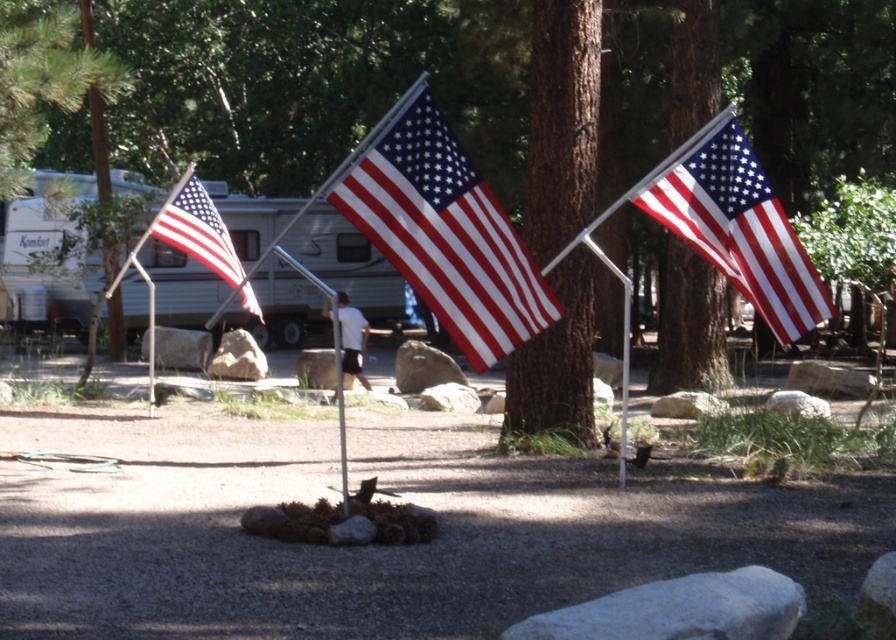
In the scene shown: Between white plastic camper at center and metallic silver pole at center, which one has less height?

Standing shorter between the two is metallic silver pole at center.

Is white plastic camper at center above metallic silver pole at center?

Indeed, white plastic camper at center is positioned over metallic silver pole at center.

What do you see at coordinates (349, 262) in the screenshot?
I see `white plastic camper at center` at bounding box center [349, 262].

You are a GUI agent. You are given a task and a screenshot of the screen. Output one action in this format:
    pyautogui.click(x=<x>, y=<y>)
    Task: Click on the white plastic camper at center
    
    Given the screenshot: What is the action you would take?
    pyautogui.click(x=349, y=262)

Is matte fabric flag at center bigger than metallic silver pole at center?

Incorrect, matte fabric flag at center is not larger than metallic silver pole at center.

Does matte fabric flag at center have a smaller size compared to metallic silver pole at center?

Correct, matte fabric flag at center occupies less space than metallic silver pole at center.

Who is more distant from viewer, (x=495, y=253) or (x=324, y=300)?

Positioned behind is point (x=324, y=300).

Locate an element on the screen. The image size is (896, 640). matte fabric flag at center is located at coordinates (445, 234).

How distant is white plastic camper at left from white cotton shirt at center?

white plastic camper at left is 17.51 feet away from white cotton shirt at center.

Is point (67, 292) more distant than point (322, 310)?

No, it is in front of (322, 310).

Locate an element on the screen. Image resolution: width=896 pixels, height=640 pixels. white plastic camper at left is located at coordinates (50, 243).